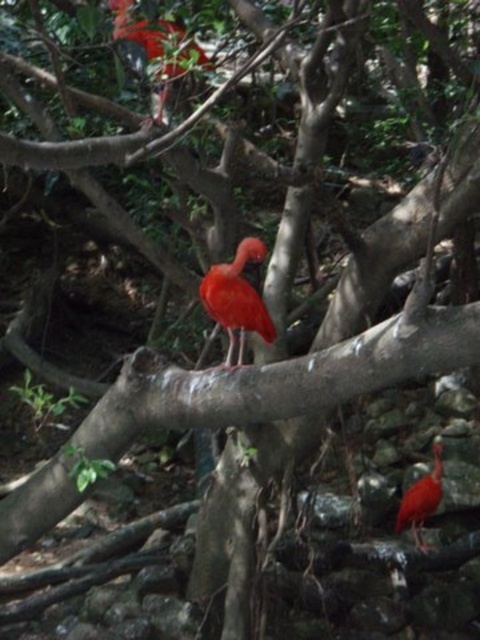
Question: Based on their relative distances, which object is nearer to the smooth glossy red bird at upper center?

Choices:
 (A) smooth glossy red bird at lower right
 (B) smooth glossy red bird at center

Answer: (B)

Question: Which point is closer to the camera?

Choices:
 (A) [183, 67]
 (B) [403, 522]
 (C) [264, 314]

Answer: (A)

Question: Can you confirm if smooth glossy red bird at center is smaller than smooth glossy red bird at upper center?

Choices:
 (A) no
 (B) yes

Answer: (B)

Question: Does smooth glossy red bird at center appear on the right side of smooth glossy red bird at lower right?

Choices:
 (A) yes
 (B) no

Answer: (B)

Question: Which of these objects is positioned farthest from the smooth glossy red bird at center?

Choices:
 (A) smooth glossy red bird at lower right
 (B) smooth glossy red bird at upper center

Answer: (A)

Question: Is smooth glossy red bird at center positioned in front of smooth glossy red bird at lower right?

Choices:
 (A) yes
 (B) no

Answer: (A)